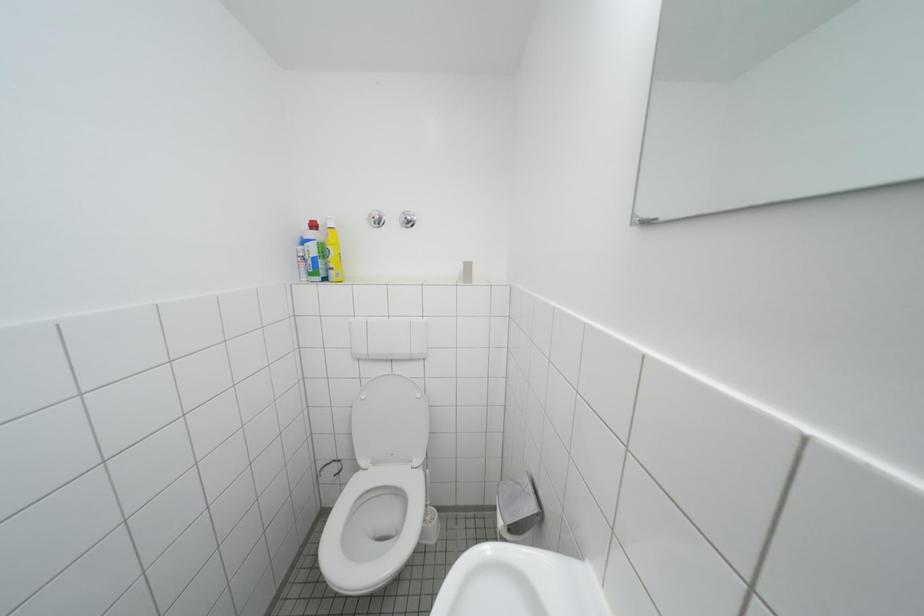
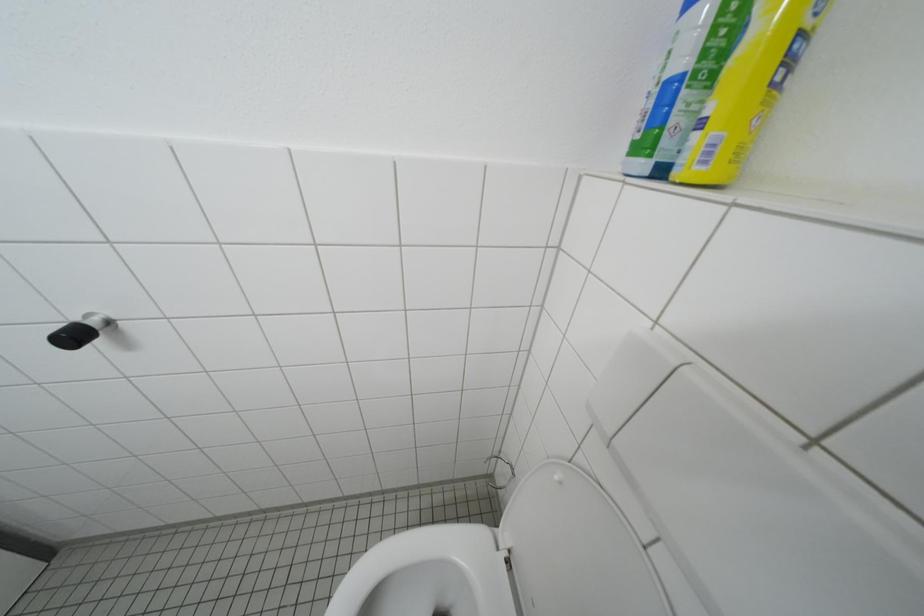
The first image is from the beginning of the video and the second image is from the end. How did the camera likely rotate when shooting the video?

The camera's rotation is toward left-down.